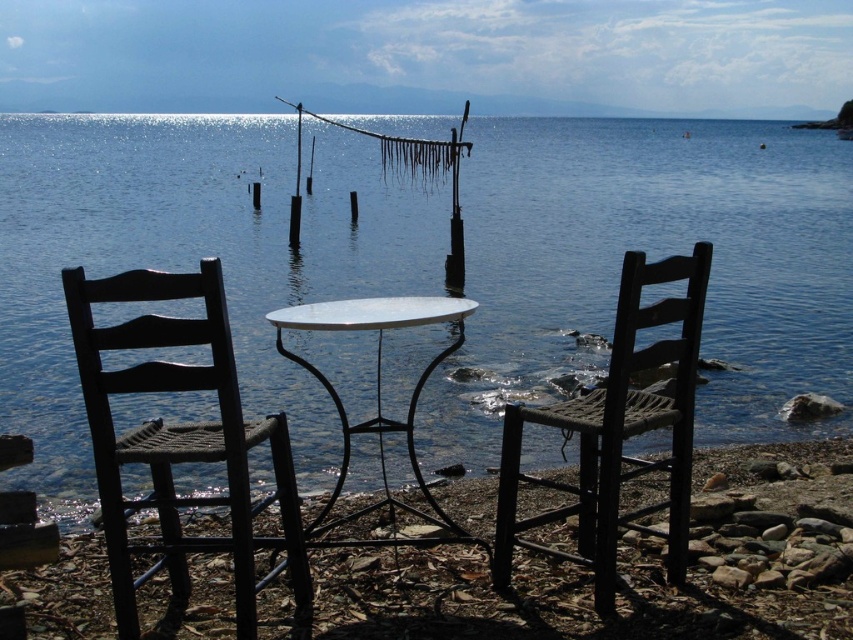
Describe the element at coordinates (616, 433) in the screenshot. I see `woven wood chair at center` at that location.

Describe the element at coordinates (616, 433) in the screenshot. The image size is (853, 640). I see `woven wood chair at center` at that location.

Identify the location of woven wood chair at center. (616, 433).

Between matte black chair at left and white marble table at center, which one has less height?

Standing shorter between the two is white marble table at center.

Which is in front, point (239, 476) or point (438, 529)?

Point (239, 476) is more forward.

Where is `matte black chair at left`? matte black chair at left is located at coordinates coord(178,438).

Which is in front, point (845, 184) or point (753, 448)?

Point (753, 448) is in front.

Is point (396, 241) positioned after point (659, 588)?

That is True.

At what (x,y) coordinates should I click in order to perform the action: click on blue water at center. Please return your answer as a coordinate pair (x, y). The image size is (853, 640). Looking at the image, I should click on (650, 259).